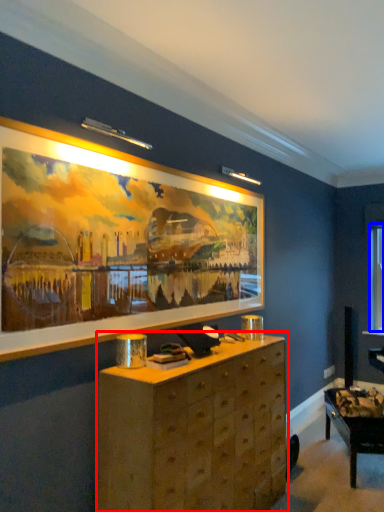
Question: Among these objects, which one is nearest to the camera, chest of drawers (highlighted by a red box) or window (highlighted by a blue box)?

Choices:
 (A) chest of drawers
 (B) window

Answer: (A)